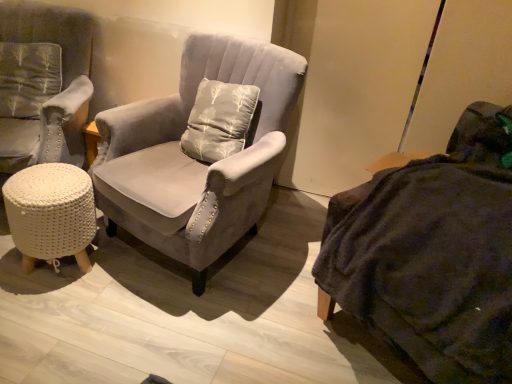
Question: From a real-world perspective, is suede gray armchair at center, the 1th chair viewed from the right, beneath velvet gray armchair at left, which ranks as the 1th chair in left-to-right order?

Choices:
 (A) no
 (B) yes

Answer: (B)

Question: From the image's perspective, would you say suede gray armchair at center, the 1th chair viewed from the right, is shown under velvet gray armchair at left, which ranks as the 1th chair in left-to-right order?

Choices:
 (A) no
 (B) yes

Answer: (B)

Question: Can you confirm if suede gray armchair at center, the 1th chair viewed from the right, is shorter than velvet gray armchair at left, marked as the second chair in a right-to-left arrangement?

Choices:
 (A) no
 (B) yes

Answer: (A)

Question: Is suede gray armchair at center, the 1th chair viewed from the right, directly adjacent to velvet gray armchair at left, which ranks as the 1th chair in left-to-right order?

Choices:
 (A) no
 (B) yes

Answer: (A)

Question: Is there a large distance between suede gray armchair at center, marked as the 2th chair in a left-to-right arrangement, and velvet gray armchair at left, marked as the second chair in a right-to-left arrangement?

Choices:
 (A) no
 (B) yes

Answer: (A)

Question: Does suede gray armchair at center, the 1th chair viewed from the right, turn towards velvet gray armchair at left, marked as the second chair in a right-to-left arrangement?

Choices:
 (A) yes
 (B) no

Answer: (B)

Question: Is white knitted stool at lower left not inside dark gray fabric couch at right?

Choices:
 (A) no
 (B) yes

Answer: (B)

Question: Is white knitted stool at lower left wider than dark gray fabric couch at right?

Choices:
 (A) no
 (B) yes

Answer: (A)

Question: Does white knitted stool at lower left have a smaller size compared to dark gray fabric couch at right?

Choices:
 (A) yes
 (B) no

Answer: (A)

Question: Considering the relative positions of white knitted stool at lower left and dark gray fabric couch at right in the image provided, is white knitted stool at lower left to the left of dark gray fabric couch at right from the viewer's perspective?

Choices:
 (A) yes
 (B) no

Answer: (A)

Question: Can you confirm if white knitted stool at lower left is shorter than dark gray fabric couch at right?

Choices:
 (A) no
 (B) yes

Answer: (B)

Question: Does white knitted stool at lower left come in front of dark gray fabric couch at right?

Choices:
 (A) no
 (B) yes

Answer: (A)

Question: From the image's perspective, does suede gray armchair at center, marked as the 2th chair in a left-to-right arrangement, appear lower than dark gray fabric couch at right?

Choices:
 (A) no
 (B) yes

Answer: (A)